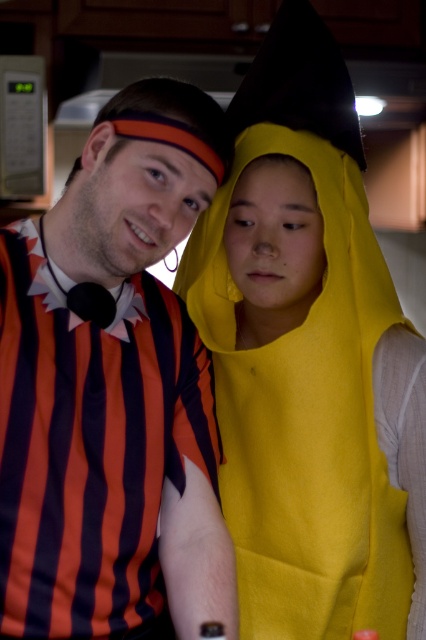
You are standing in the kitchen and want to hand a banana to the person wearing the yellow felt costume at center. Which direction should you move to approach them first before reaching the matte striped shirt at left?

The yellow felt costume at center is closer to you than the matte striped shirt at left, so you should move towards the yellow felt costume at center first to hand the banana.

You are a delivery person who needs to place a small package between the yellow felt costume at center and the matte striped shirt at left. Can you fit it there?

The distance between the yellow felt costume at center and the matte striped shirt at left is 8.71 inches, so the small package can fit there as long as it is smaller than that distance.